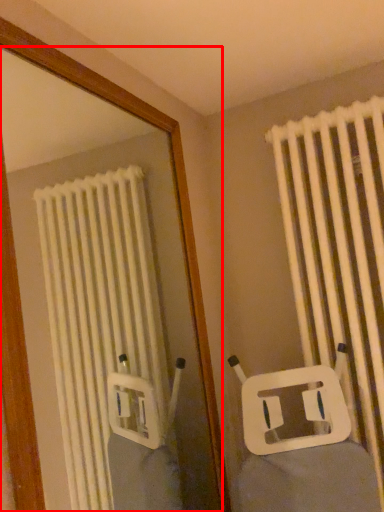
Question: From the image's perspective, what is the correct spatial positioning of mirror (annotated by the red box) in reference to curtain?

Choices:
 (A) above
 (B) below

Answer: (B)